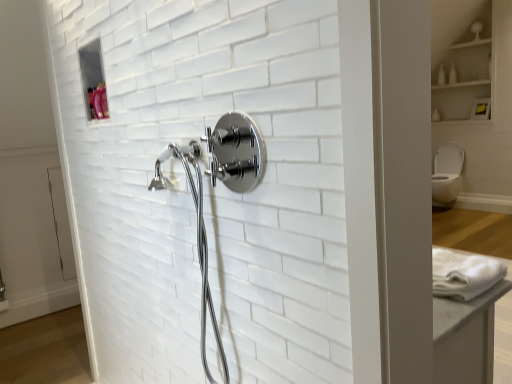
Locate an element on the screen. The width and height of the screenshot is (512, 384). chrome/metallic showerhead at center is located at coordinates [x=234, y=152].

Identify the location of white glossy cabinet at upper right. This screenshot has height=384, width=512. (465, 71).

Describe the element at coordinates (441, 76) in the screenshot. The height and width of the screenshot is (384, 512). I see `white glossy bottle at upper right` at that location.

Describe the element at coordinates (447, 174) in the screenshot. I see `white glossy toilet bowl at right` at that location.

The width and height of the screenshot is (512, 384). Identify the location of chrome/metallic showerhead at center. (234, 152).

Is white glossy toilet bowl at right completely or partially outside of white glossy cabinet at upper right?

Yes.

Which is further, (450, 203) or (475, 35)?

The point (475, 35) is farther.

Is white glossy toilet bowl at right looking in the opposite direction of white glossy cabinet at upper right?

No, white glossy cabinet at upper right is not at the back of white glossy toilet bowl at right.

Locate an element on the screen. This screenshot has width=512, height=384. cabinet lying in front of the white glossy toilet bowl at right is located at coordinates (465, 71).

Would you consider white glossy bottle at upper right to be distant from chrome/metallic showerhead at center?

Indeed, white glossy bottle at upper right is not near chrome/metallic showerhead at center.

From the image's perspective, does white glossy bottle at upper right appear higher than chrome/metallic showerhead at center?

Yes, from the image's perspective, white glossy bottle at upper right is on top of chrome/metallic showerhead at center.

Does point (442, 72) lie in front of point (238, 124)?

That is False.

You are a GUI agent. You are given a task and a screenshot of the screen. Output one action in this format:
    pyautogui.click(x=<x>, y=<y>)
    Task: Click on the toiletry above the chrome/metallic showerhead at center (from a real-world perspective)
    
    Given the screenshot: What is the action you would take?
    pyautogui.click(x=441, y=76)

Based on the photo, which of these two, chrome/metallic showerhead at center or white glossy toilet bowl at right, is wider?

With larger width is white glossy toilet bowl at right.

Can you confirm if chrome/metallic showerhead at center is positioned to the right of white glossy toilet bowl at right?

In fact, chrome/metallic showerhead at center is to the left of white glossy toilet bowl at right.

Can you tell me how much chrome/metallic showerhead at center and white glossy toilet bowl at right differ in facing direction?

The facing directions of chrome/metallic showerhead at center and white glossy toilet bowl at right are 1.87 degrees apart.

From a real-world perspective, relative to white glossy bottle at upper right, is chrome/metallic showerhead at center vertically above or below?

chrome/metallic showerhead at center is below white glossy bottle at upper right.

Does point (179, 154) lie behind point (444, 80)?

No, (179, 154) is closer to viewer.

Which object is closer to the camera, chrome/metallic showerhead at center or white glossy bottle at upper right?

chrome/metallic showerhead at center is in front.

Is chrome/metallic showerhead at center thinner than white glossy bottle at upper right?

No, chrome/metallic showerhead at center is not thinner than white glossy bottle at upper right.

Is chrome/metallic showerhead at center completely or partially inside white glossy toilet bowl at right?

No, chrome/metallic showerhead at center is not inside white glossy toilet bowl at right.

Is white glossy toilet bowl at right taller or shorter than chrome/metallic showerhead at center?

Clearly, white glossy toilet bowl at right is taller compared to chrome/metallic showerhead at center.

Where is `toilet bowl that appears above the chrome/metallic showerhead at center (from the image's perspective)`? The height and width of the screenshot is (384, 512). toilet bowl that appears above the chrome/metallic showerhead at center (from the image's perspective) is located at coordinates (447, 174).

Considering the sizes of objects white glossy toilet bowl at right and chrome/metallic showerhead at center in the image provided, who is wider, white glossy toilet bowl at right or chrome/metallic showerhead at center?

white glossy toilet bowl at right.

From a real-world perspective, relative to white glossy cabinet at upper right, is white glossy bottle at upper right vertically above or below?

Clearly, from a real-world perspective, white glossy bottle at upper right is below white glossy cabinet at upper right.

The height and width of the screenshot is (384, 512). Find the location of `toiletry below the white glossy cabinet at upper right (from the image's perspective)`. toiletry below the white glossy cabinet at upper right (from the image's perspective) is located at coordinates (441, 76).

Considering the relative sizes of white glossy bottle at upper right and white glossy cabinet at upper right in the image provided, is white glossy bottle at upper right shorter than white glossy cabinet at upper right?

Correct, white glossy bottle at upper right is not as tall as white glossy cabinet at upper right.

From the image's perspective, which is below, white glossy bottle at upper right or white glossy cabinet at upper right?

white glossy bottle at upper right, from the image's perspective.

Considering their positions, is white glossy bottle at upper right located in front of or behind white glossy toilet bowl at right?

white glossy bottle at upper right is behind white glossy toilet bowl at right.

From the image's perspective, which is below, white glossy bottle at upper right or white glossy toilet bowl at right?

white glossy toilet bowl at right, from the image's perspective.

Looking at this image, from a real-world perspective, is white glossy bottle at upper right positioned under white glossy toilet bowl at right based on gravity?

Incorrect, from a real-world perspective, white glossy bottle at upper right is higher than white glossy toilet bowl at right.

Is white glossy bottle at upper right at the left side of white glossy toilet bowl at right?

In fact, white glossy bottle at upper right is to the right of white glossy toilet bowl at right.

Image resolution: width=512 pixels, height=384 pixels. Find the location of `toilet bowl that is on the left side of white glossy cabinet at upper right`. toilet bowl that is on the left side of white glossy cabinet at upper right is located at coordinates (447, 174).

Locate an element on the screen. Image resolution: width=512 pixels, height=384 pixels. toiletry that is behind the chrome/metallic showerhead at center is located at coordinates click(441, 76).

When comparing their distances from white glossy cabinet at upper right, does white glossy bottle at upper right or white glossy toilet bowl at right seem further?

Based on the image, white glossy toilet bowl at right appears to be further to white glossy cabinet at upper right.

Which object lies nearer to the anchor point white glossy bottle at upper right, chrome/metallic showerhead at center or white glossy cabinet at upper right?

white glossy cabinet at upper right.

Considering their positions, is white glossy bottle at upper right positioned further to chrome/metallic showerhead at center than white glossy toilet bowl at right?

white glossy bottle at upper right is further to chrome/metallic showerhead at center.

Estimate the real-world distances between objects in this image. Which object is further from white glossy cabinet at upper right, white glossy toilet bowl at right or chrome/metallic showerhead at center?

Among the two, chrome/metallic showerhead at center is located further to white glossy cabinet at upper right.

Looking at the image, which one is located closer to white glossy cabinet at upper right, chrome/metallic showerhead at center or white glossy toilet bowl at right?

white glossy toilet bowl at right is closer to white glossy cabinet at upper right.

Considering their positions, is white glossy bottle at upper right positioned further to chrome/metallic showerhead at center than white glossy cabinet at upper right?

Based on the image, white glossy bottle at upper right appears to be further to chrome/metallic showerhead at center.

Looking at the image, which one is located further to white glossy toilet bowl at right, white glossy bottle at upper right or chrome/metallic showerhead at center?

Among the two, chrome/metallic showerhead at center is located further to white glossy toilet bowl at right.

From the image, which object appears to be farther from white glossy toilet bowl at right, white glossy bottle at upper right or white glossy cabinet at upper right?

The object further to white glossy toilet bowl at right is white glossy bottle at upper right.

Find the location of `cabinet between chrome/metallic showerhead at center and white glossy bottle at upper right along the z-axis`. cabinet between chrome/metallic showerhead at center and white glossy bottle at upper right along the z-axis is located at coordinates (465, 71).

Where is `toiletry between white glossy cabinet at upper right and white glossy toilet bowl at right vertically`? toiletry between white glossy cabinet at upper right and white glossy toilet bowl at right vertically is located at coordinates [441, 76].

In order to click on toilet bowl positioned between chrome/metallic showerhead at center and white glossy bottle at upper right from near to far in this screenshot , I will do `click(447, 174)`.

The height and width of the screenshot is (384, 512). I want to click on cabinet positioned between chrome/metallic showerhead at center and white glossy toilet bowl at right from near to far, so click(465, 71).